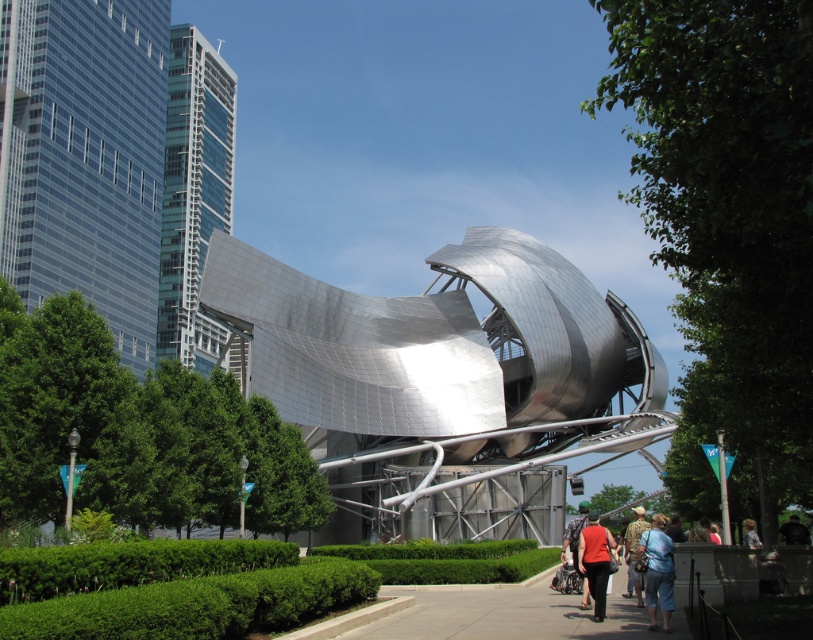
Can you confirm if blue denim jeans at lower right is smaller than camouflage fabric shirt at center?

Indeed, blue denim jeans at lower right has a smaller size compared to camouflage fabric shirt at center.

Between blue denim jeans at lower right and camouflage fabric shirt at center, which one appears on the left side from the viewer's perspective?

Positioned to the left is blue denim jeans at lower right.

Who is more forward, (648, 628) or (633, 509)?

Point (648, 628) is in front.

You are a GUI agent. You are given a task and a screenshot of the screen. Output one action in this format:
    pyautogui.click(x=<x>, y=<y>)
    Task: Click on the blue denim jeans at lower right
    The image size is (813, 640).
    Given the screenshot: What is the action you would take?
    pyautogui.click(x=657, y=570)

Does glassy steel skyscraper at upper left have a lesser width compared to black leather jacket at lower right?

Yes.

This screenshot has width=813, height=640. Find the location of `glassy steel skyscraper at upper left`. glassy steel skyscraper at upper left is located at coordinates (193, 193).

Is point (450, 632) less distant than point (588, 548)?

Yes, it is in front of point (588, 548).

Between point (380, 636) and point (598, 566), which one is positioned in front?

Point (380, 636)

This screenshot has width=813, height=640. I want to click on concrete sidewalk at center, so click(509, 612).